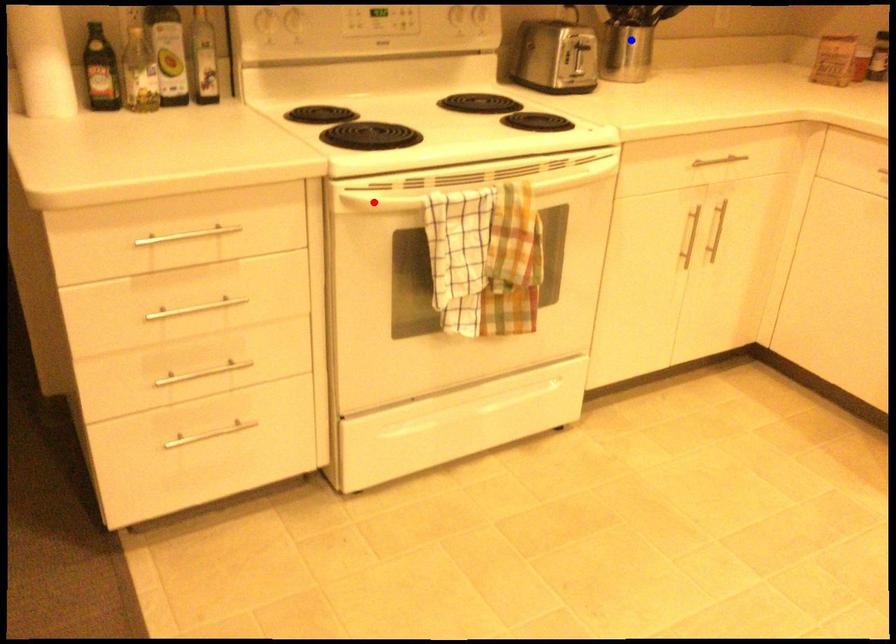
Question: In the image, two points are highlighted. Which point is nearer to the camera? Reply with the corresponding letter.

Choices:
 (A) blue point
 (B) red point

Answer: (B)